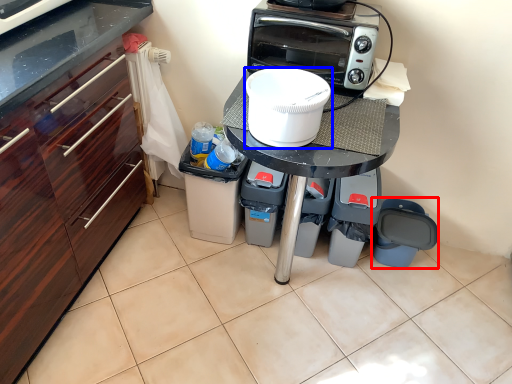
Question: Among these objects, which one is nearest to the camera, appliance (highlighted by a red box) or home appliance (highlighted by a blue box)?

Choices:
 (A) appliance
 (B) home appliance

Answer: (B)